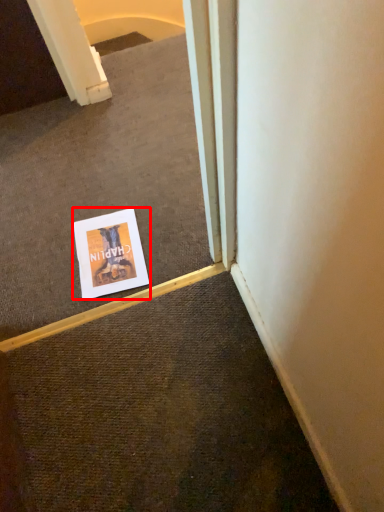
Question: Considering the relative positions of poster (annotated by the red box) and escalator in the image provided, where is poster (annotated by the red box) located with respect to the staircase?

Choices:
 (A) right
 (B) left

Answer: (A)